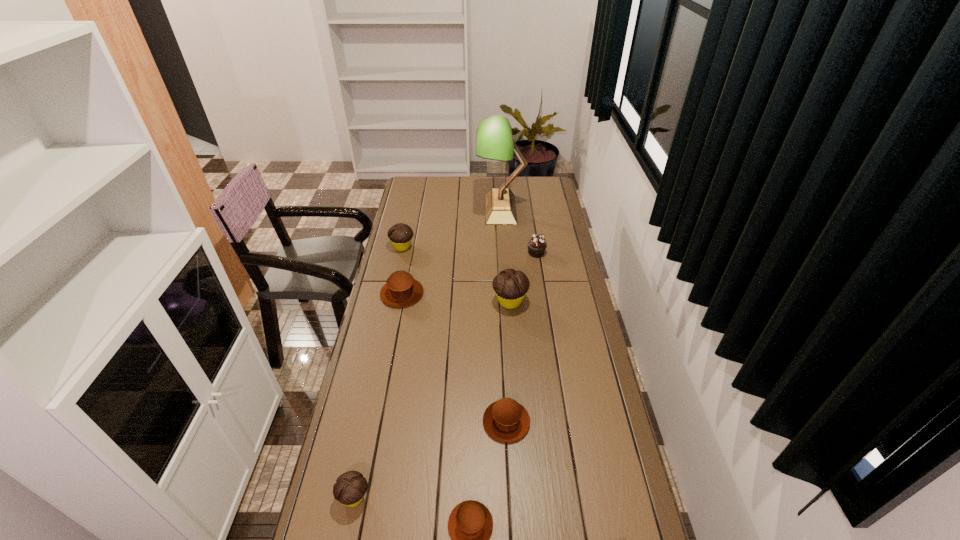
Identify the location of the third nearest muffin. Image resolution: width=960 pixels, height=540 pixels. (505, 420).

Locate an element on the screen. The width and height of the screenshot is (960, 540). the smallest chocolate muffin is located at coordinates (350, 487).

Where is `vacant space located 0.270m on the metallic stand of the tallest object`? vacant space located 0.270m on the metallic stand of the tallest object is located at coordinates (425, 209).

Identify the location of free region located 0.380m on the metallic stand of the tallest object. (404, 209).

Where is `vacant space located on the metallic stand of the tallest object`? This screenshot has width=960, height=540. vacant space located on the metallic stand of the tallest object is located at coordinates (441, 209).

This screenshot has height=540, width=960. In order to click on vacant space located on the back of the rightmost chocolate muffin in this screenshot , I will do `click(507, 258)`.

Where is `vacant space located on the front of the farthest muffin`? This screenshot has width=960, height=540. vacant space located on the front of the farthest muffin is located at coordinates [390, 306].

At what (x,y) coordinates should I click in order to perform the action: click on free region located 0.250m on the front of the farthest brown muffin. Please return your answer as a coordinate pair (x, y). Looking at the image, I should click on (390, 358).

Find the location of a particular element. vacant space positioned on the front of the cupcake is located at coordinates (540, 274).

This screenshot has height=540, width=960. Identify the location of blank space located 0.350m on the left of the third nearest object. (372, 422).